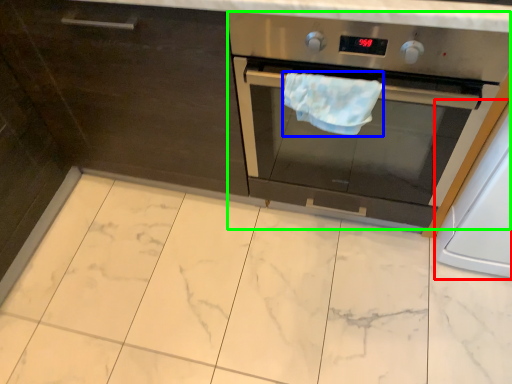
Question: Which is nearer to the appliance (highlighted by a red box)? hand towel (highlighted by a blue box) or home appliance (highlighted by a green box).

Choices:
 (A) hand towel
 (B) home appliance

Answer: (B)